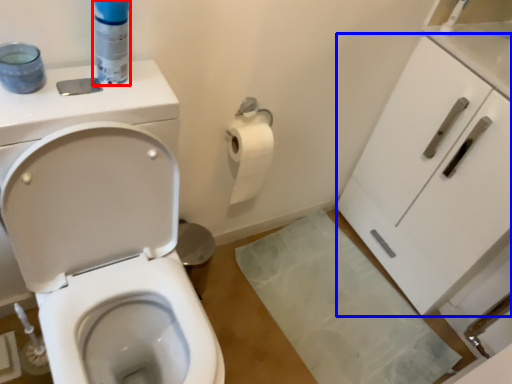
Question: Which object is closer to the camera taking this photo, cleaning product (highlighted by a red box) or cabinetry (highlighted by a blue box)?

Choices:
 (A) cleaning product
 (B) cabinetry

Answer: (A)